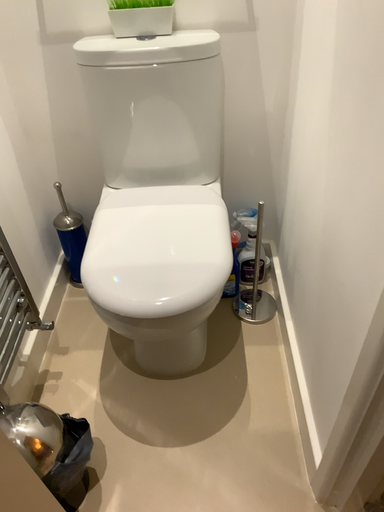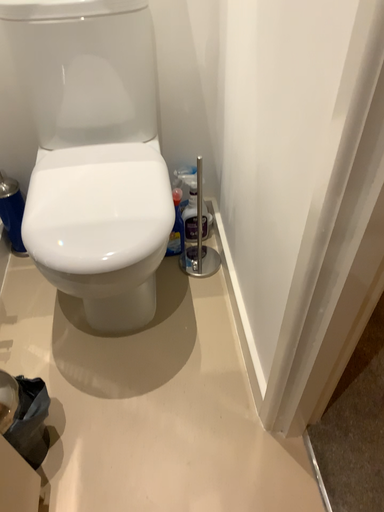
Question: How did the camera likely rotate when shooting the video?

Choices:
 (A) rotated left
 (B) rotated right

Answer: (B)